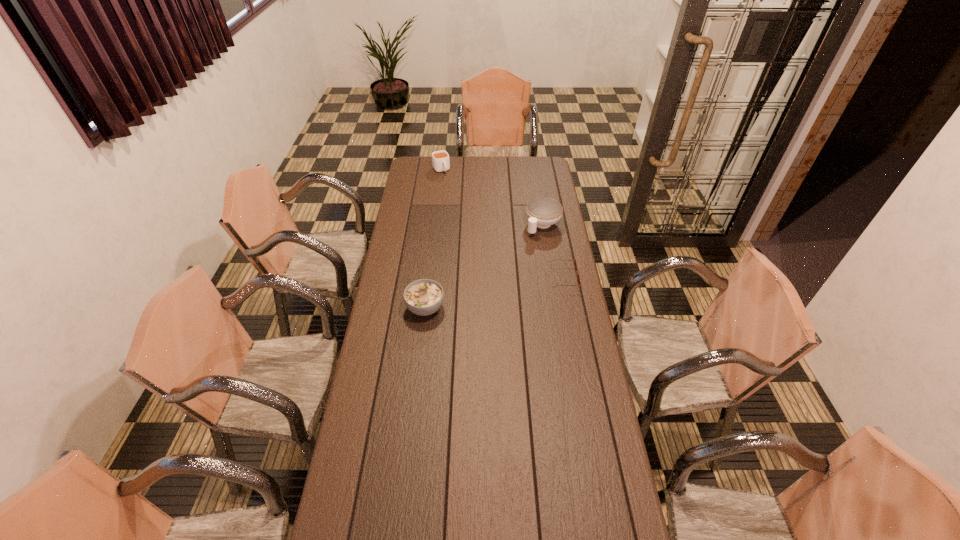
You are a GUI agent. You are given a task and a screenshot of the screen. Output one action in this format:
    pyautogui.click(x=<x>, y=<y>)
    Task: Click on the vacant space at the left edge of the desktop
    The width and height of the screenshot is (960, 540).
    Given the screenshot: What is the action you would take?
    pyautogui.click(x=402, y=308)

You are a GUI agent. You are given a task and a screenshot of the screen. Output one action in this format:
    pyautogui.click(x=<x>, y=<y>)
    Task: Click on the vacant region at the right edge of the desktop
    This screenshot has height=540, width=960.
    Given the screenshot: What is the action you would take?
    562,341

At what (x,y) coordinates should I click in order to perform the action: click on free space at the far left corner. Please return your answer as a coordinate pair (x, y). This screenshot has width=960, height=540. Looking at the image, I should click on (426, 171).

The image size is (960, 540). Identify the location of vacant space in between the soup bowl and the third farthest object. (494, 292).

This screenshot has height=540, width=960. I want to click on vacant area between the farthest object and the chinaware, so click(492, 198).

Locate an element on the screen. vacant point located between the soup bowl and the third nearest object is located at coordinates (484, 266).

I want to click on empty space that is in between the cup and the chinaware, so click(x=492, y=198).

The height and width of the screenshot is (540, 960). I want to click on unoccupied area between the cup and the chinaware, so click(x=492, y=198).

Where is `free space that is in between the nearest object and the cup`? The width and height of the screenshot is (960, 540). free space that is in between the nearest object and the cup is located at coordinates (433, 239).

Where is `empty location between the chinaware and the shortest object`? The image size is (960, 540). empty location between the chinaware and the shortest object is located at coordinates (553, 251).